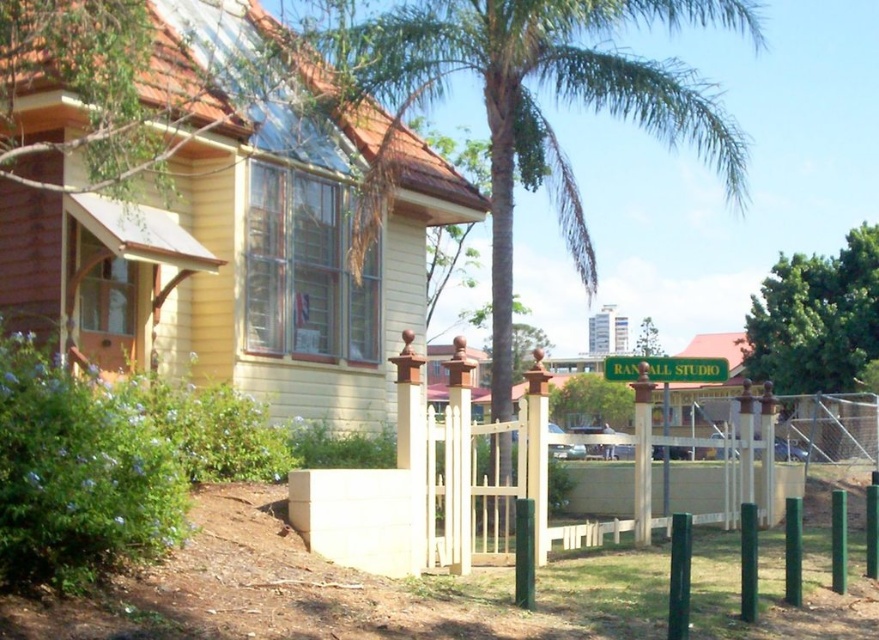
Is green leafy palm tree at center shorter than green leafy tree at right?

Incorrect, green leafy palm tree at center's height does not fall short of green leafy tree at right's.

Which is more to the left, green leafy palm tree at center or green leafy tree at right?

From the viewer's perspective, green leafy palm tree at center appears more on the left side.

Is point (739, 131) closer to viewer compared to point (869, 280)?

Yes.

Image resolution: width=879 pixels, height=640 pixels. Identify the location of green leafy palm tree at center. (527, 104).